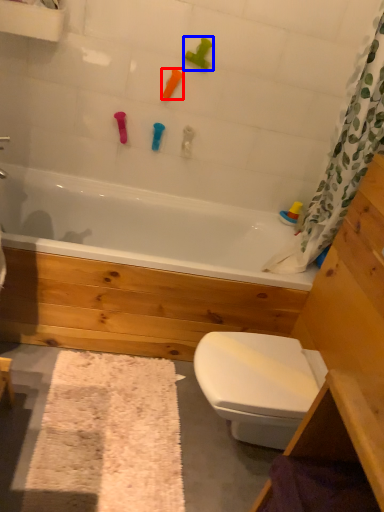
Question: Which of the following is the closest to the observer, toy (highlighted by a red box) or toy (highlighted by a blue box)?

Choices:
 (A) toy
 (B) toy

Answer: (B)